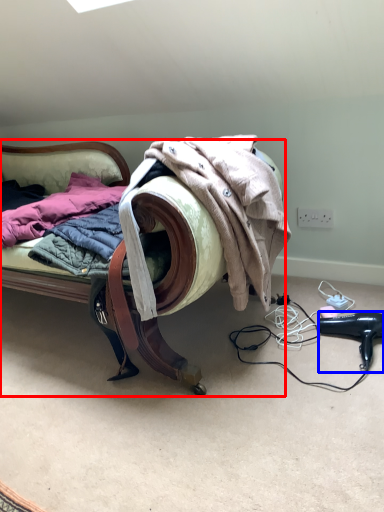
Question: Which object appears farthest to the camera in this image, furniture (highlighted by a red box) or hair drier (highlighted by a blue box)?

Choices:
 (A) furniture
 (B) hair drier

Answer: (B)